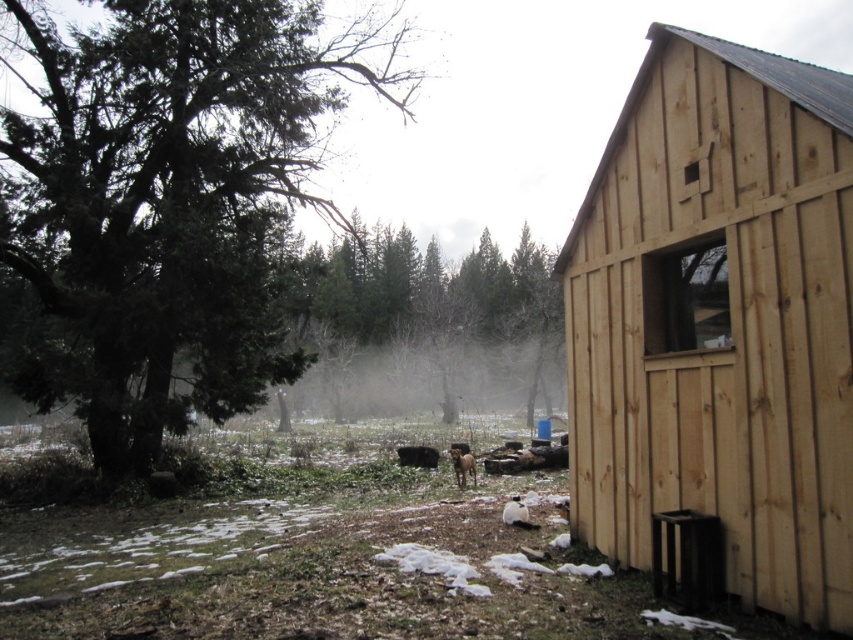
You are planning to plant a new tree in this rural area. The green textured tree at left and the green matte tree at center are already present. Which existing tree should you consider for spacing requirements if you want to plant a tree that needs more vertical space?

The green textured tree at left is taller than the green matte tree at center, so you should consider the green textured tree at left for spacing requirements if you want to plant a tree that needs more vertical space.

You are planning to install a new satellite dish on the highest point between the natural wood cabin at right and the green matte tree at center. Which object should you choose for the installation?

The green matte tree at center is taller than the natural wood cabin at right, so you should install the satellite dish on the green matte tree at center to achieve the highest point.

You are standing in the rural scene looking at the wooden structure. There are two points marked in the image. Which of the two points, point [614,362] or point [427,257], is closer to you?

Point [614,362] is closer to you than point [427,257].